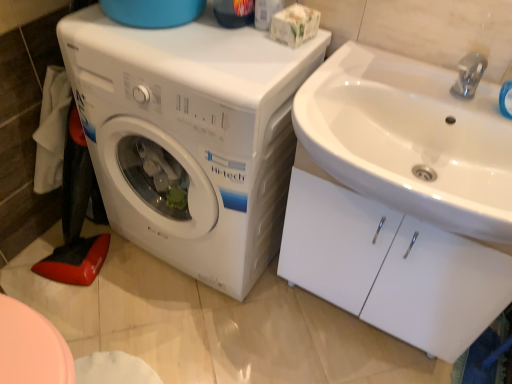
Question: Does point (398, 236) appear closer or farther from the camera than point (192, 218)?

Choices:
 (A) farther
 (B) closer

Answer: (B)

Question: Is white glossy sink at upper right inside the boundaries of white plastic washing machine at left, or outside?

Choices:
 (A) inside
 (B) outside

Answer: (B)

Question: Estimate the real-world distances between objects in this image. Which object is farther from the white glossy sink at upper right?

Choices:
 (A) white plastic washing machine at left
 (B) white glossy sink at upper right

Answer: (A)

Question: Estimate the real-world distances between objects in this image. Which object is farther from the white plastic washing machine at left?

Choices:
 (A) white glossy sink at upper right
 (B) white glossy sink at upper right

Answer: (A)